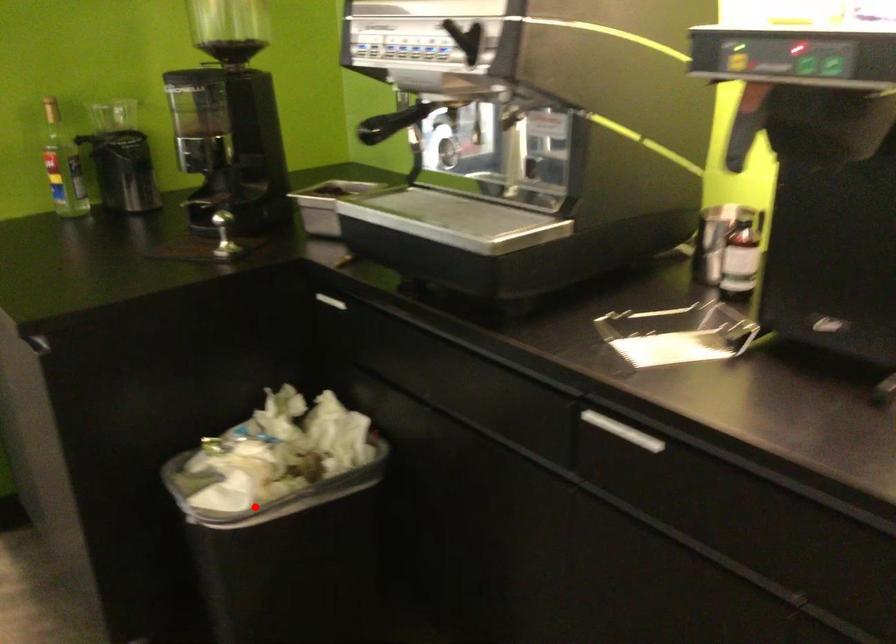
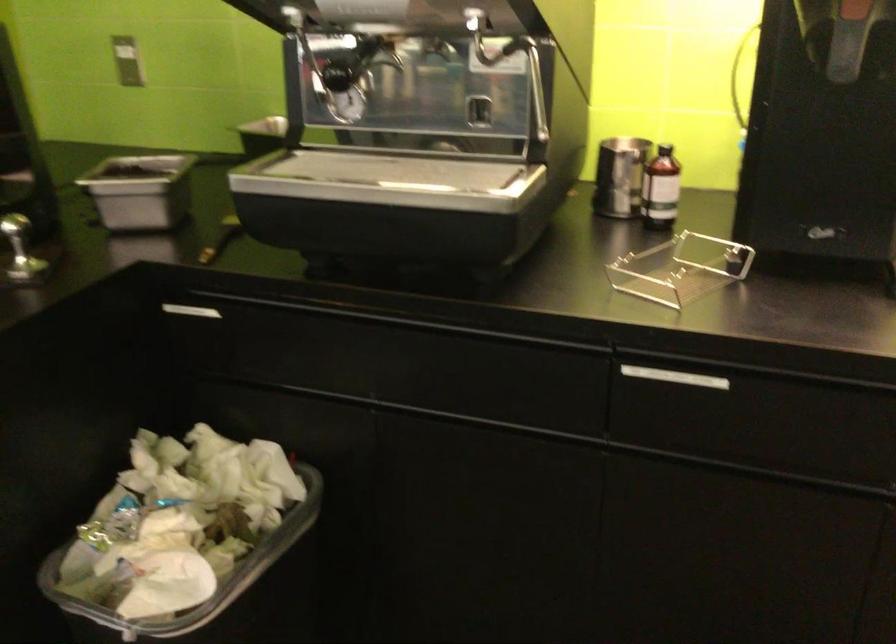
Question: I am providing you with two images of the same scene from different viewpoints. In image1, a red point is highlighted. Considering the same 3D point in image2, which of the following is correct?

Choices:
 (A) It is closer
 (B) It is farther

Answer: (A)